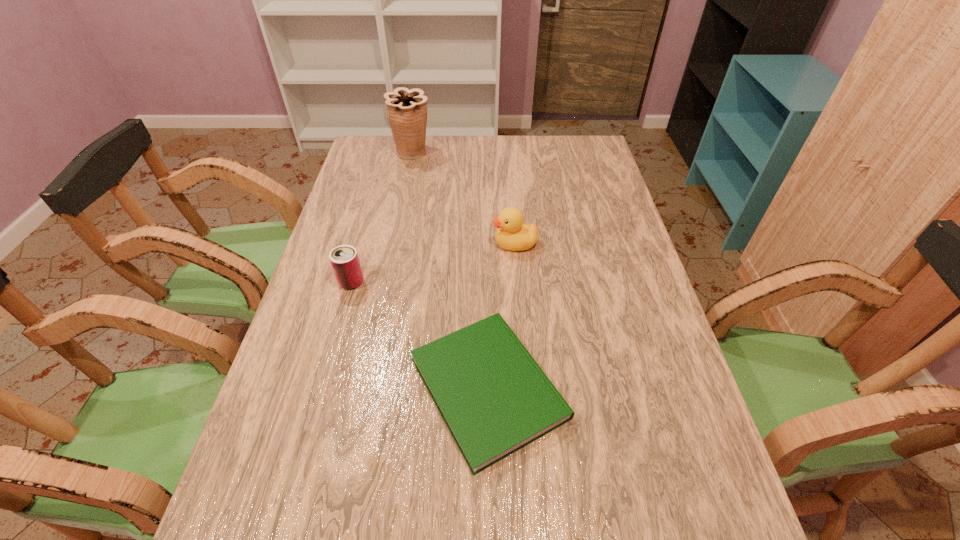
I want to click on vacant space situated 0.140m at the beak of the third shortest object, so click(x=444, y=244).

The width and height of the screenshot is (960, 540). I want to click on free location located 0.400m at the beak of the third shortest object, so click(x=353, y=244).

The image size is (960, 540). Identify the location of vacant space situated on the back of the third tallest object. (366, 230).

Identify the location of free location located on the left of the nearest object. The height and width of the screenshot is (540, 960). (380, 388).

This screenshot has height=540, width=960. What are the coordinates of `object that is at the far edge` in the screenshot? It's located at (406, 109).

The height and width of the screenshot is (540, 960). Find the location of `urn that is at the left edge`. urn that is at the left edge is located at coordinates (406, 109).

Image resolution: width=960 pixels, height=540 pixels. In order to click on can that is at the left edge in this screenshot , I will do `click(344, 259)`.

Find the location of `object situated at the far left corner`. object situated at the far left corner is located at coordinates (406, 109).

In the image, there is a desktop. Where is `vacant space at the far edge`? This screenshot has width=960, height=540. vacant space at the far edge is located at coordinates (492, 150).

The image size is (960, 540). In order to click on vacant region at the left edge in this screenshot , I will do `click(324, 332)`.